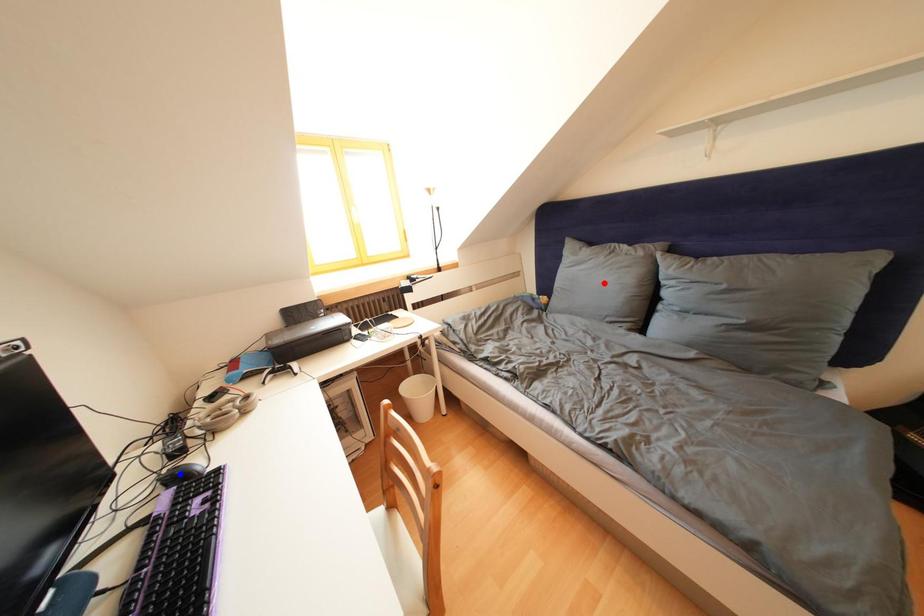
Question: Two points are marked on the image. Which point is closer to the camera?

Choices:
 (A) Blue point is closer.
 (B) Red point is closer.

Answer: (A)